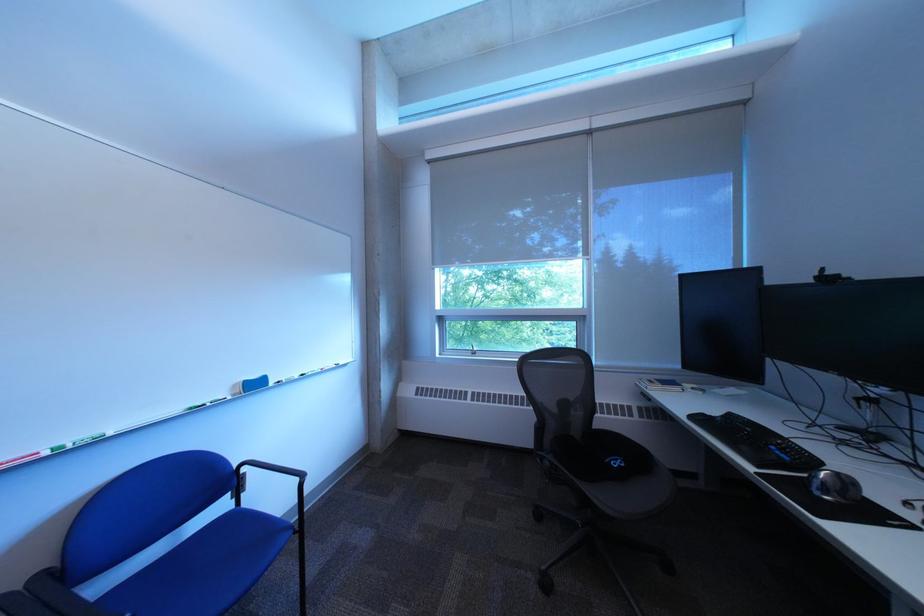
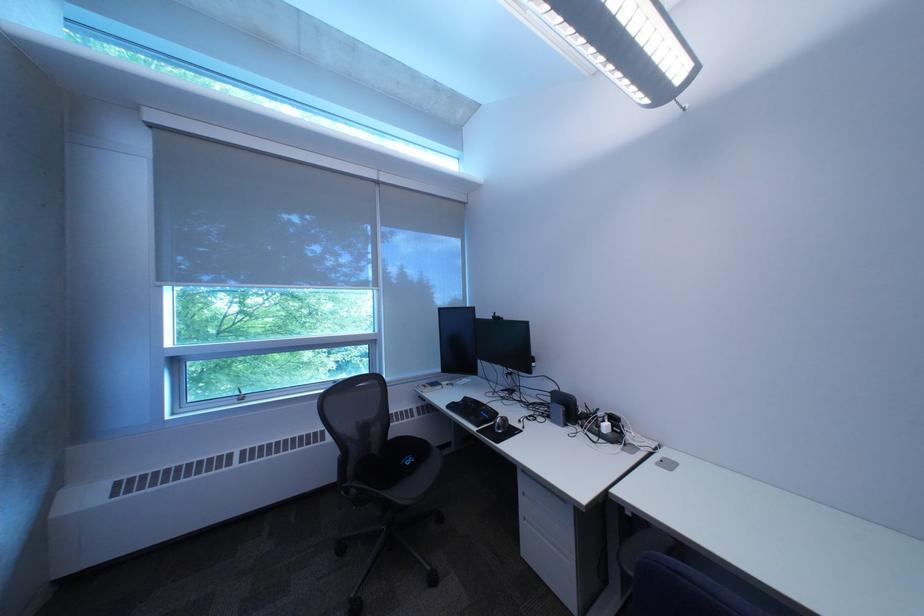
Find the pixel in the second image that matches point (590, 323) in the first image.

(383, 347)